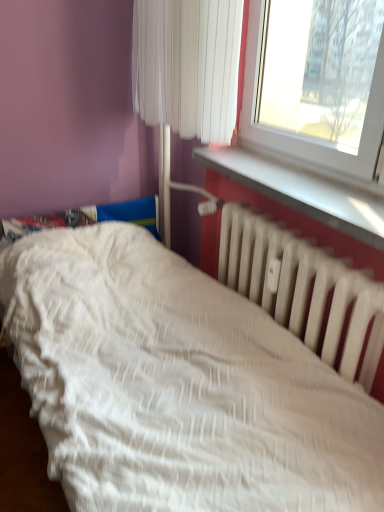
Question: Considering the positions of white fabric curtain at upper center and white matte radiator at lower right in the image, is white fabric curtain at upper center taller or shorter than white matte radiator at lower right?

Choices:
 (A) short
 (B) tall

Answer: (A)

Question: Looking at the image, does white fabric curtain at upper center seem bigger or smaller compared to white matte radiator at lower right?

Choices:
 (A) big
 (B) small

Answer: (A)

Question: Considering the real-world distances, which object is farthest from the white textured bed at lower left?

Choices:
 (A) white fabric curtain at upper center
 (B) white plastic window sill at upper right
 (C) white matte radiator at lower right

Answer: (A)

Question: Estimate the real-world distances between objects in this image. Which object is farther from the white matte radiator at lower right?

Choices:
 (A) white fabric curtain at upper center
 (B) white textured bed at lower left
 (C) white plastic window sill at upper right

Answer: (A)